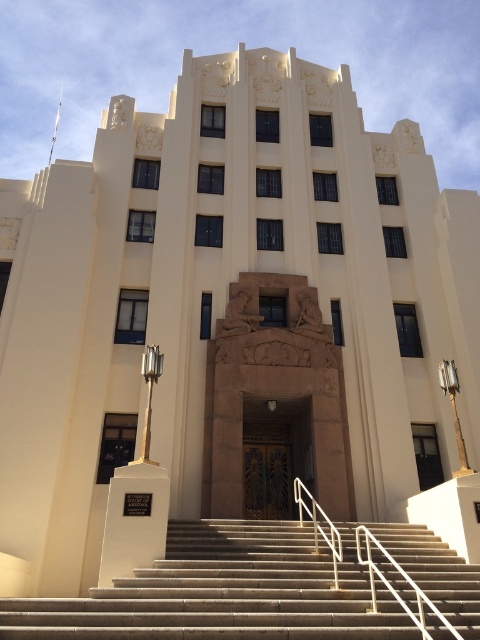
Can you confirm if concrete stairs at center is taller than brown wood door at center?

Yes, concrete stairs at center is taller than brown wood door at center.

Is concrete stairs at center in front of brown wood door at center?

That is True.

You are a GUI agent. You are given a task and a screenshot of the screen. Output one action in this format:
    pyautogui.click(x=<x>, y=<y>)
    Task: Click on the concrete stairs at center
    
    Given the screenshot: What is the action you would take?
    pyautogui.click(x=224, y=593)

Which is above, concrete stairs at center or white marble monument at lower center?

Positioned higher is white marble monument at lower center.

Does concrete stairs at center have a lesser height compared to white marble monument at lower center?

Indeed, concrete stairs at center has a lesser height compared to white marble monument at lower center.

This screenshot has width=480, height=640. I want to click on concrete stairs at center, so click(x=224, y=593).

Can you confirm if brown wood door at center is shorter than white marble monument at lower center?

Correct, brown wood door at center is not as tall as white marble monument at lower center.

Looking at this image, does brown wood door at center appear over white marble monument at lower center?

No.

Is point (264, 499) positioned behind point (139, 518)?

Yes, it is behind point (139, 518).

The image size is (480, 640). I want to click on brown wood door at center, so click(x=275, y=456).